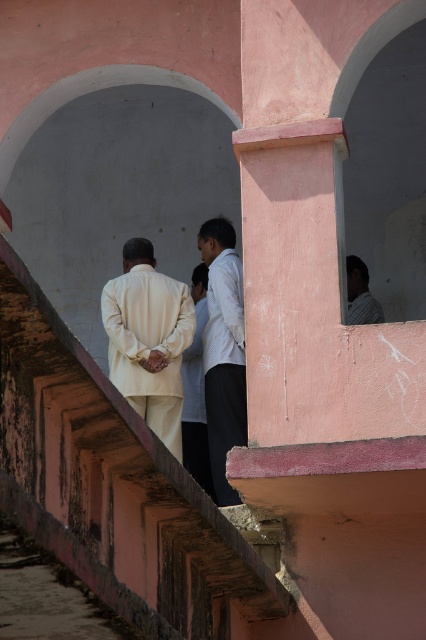
Which is more to the right, matte cream suit at center or light brown shirt at upper right?

Positioned to the right is light brown shirt at upper right.

You are a GUI agent. You are given a task and a screenshot of the screen. Output one action in this format:
    pyautogui.click(x=<x>, y=<y>)
    Task: Click on the matte cream suit at center
    This screenshot has width=426, height=640.
    Given the screenshot: What is the action you would take?
    149,339

Who is positioned more to the left, light beige fabric robe at center or light brown shirt at upper right?

Positioned to the left is light beige fabric robe at center.

Which is below, light beige fabric robe at center or light brown shirt at upper right?

light beige fabric robe at center is below.

Where is `light beige fabric robe at center`? This screenshot has height=640, width=426. light beige fabric robe at center is located at coordinates (195, 401).

Image resolution: width=426 pixels, height=640 pixels. What are the coordinates of `light beige fabric robe at center` in the screenshot? It's located at (195, 401).

Is point (218, 371) positioned behind point (379, 320)?

No, it is in front of (379, 320).

What do you see at coordinates (224, 368) in the screenshot? I see `white matte shirt at center` at bounding box center [224, 368].

I want to click on white matte shirt at center, so click(224, 368).